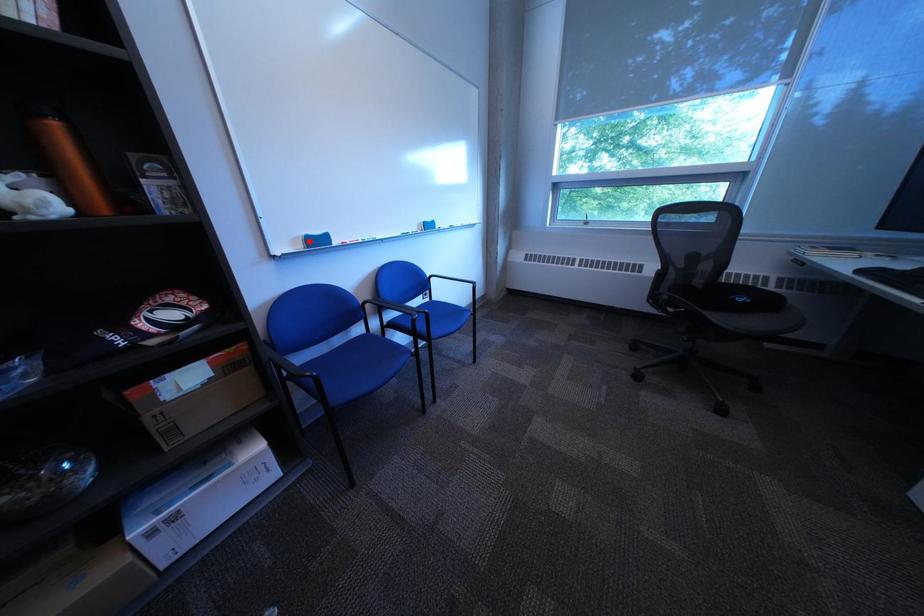
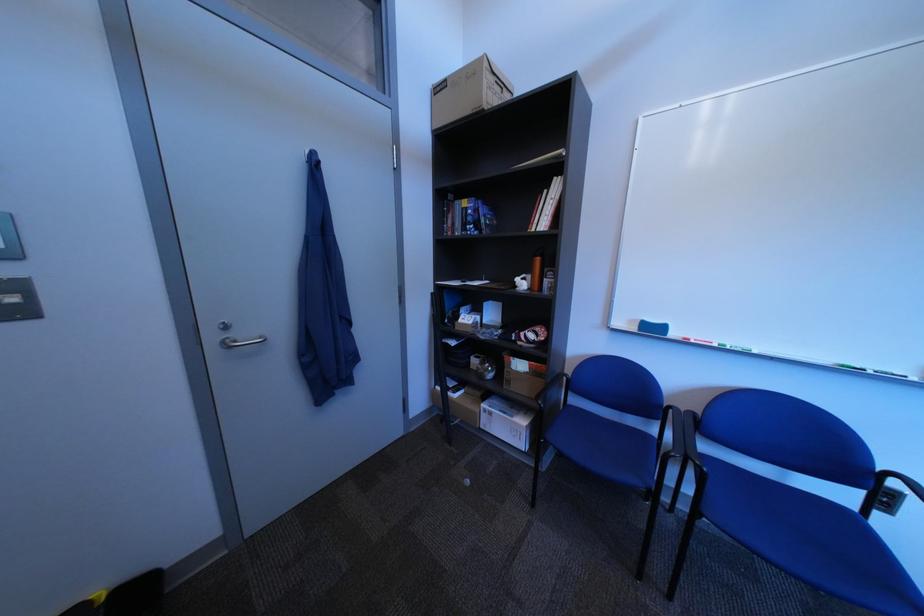
Find the pixel in the second image that matches the highlighted location in the first image.

(647, 323)